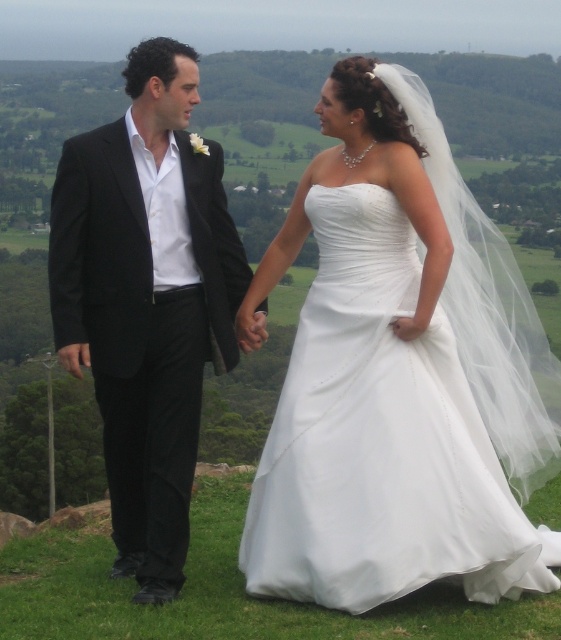
Question: Does white satin dress at center appear under matte black suit at left?

Choices:
 (A) no
 (B) yes

Answer: (B)

Question: Which of the following is the closest to the observer?

Choices:
 (A) matte black suit at left
 (B) white satin dress at center

Answer: (B)

Question: Does white satin dress at center lie in front of matte black suit at left?

Choices:
 (A) yes
 (B) no

Answer: (A)

Question: Can you confirm if white satin dress at center is positioned below matte black suit at left?

Choices:
 (A) yes
 (B) no

Answer: (A)

Question: Which of the following is the closest to the observer?

Choices:
 (A) matte black suit at left
 (B) white satin dress at center

Answer: (B)